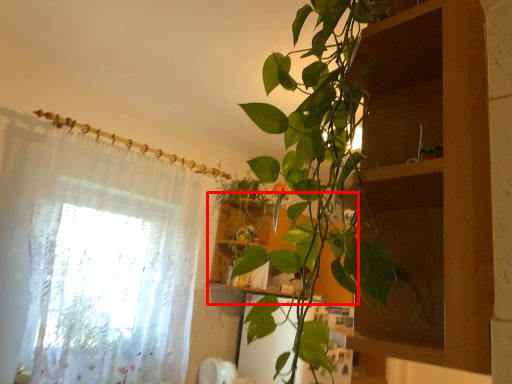
Question: Considering the relative positions of cabinet (annotated by the red box) and curtain in the image provided, where is cabinet (annotated by the red box) located with respect to the staircase?

Choices:
 (A) right
 (B) left

Answer: (A)